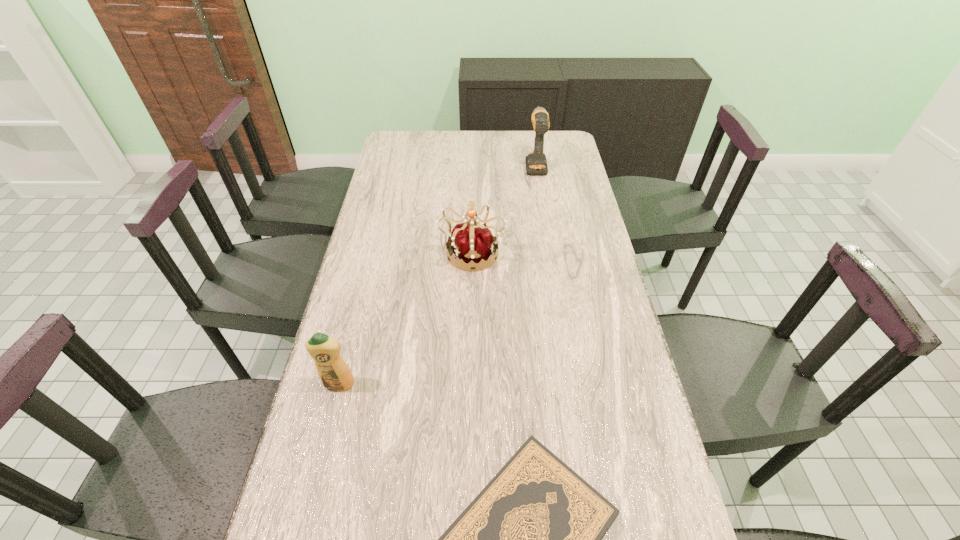
Point out which object is positioned as the second nearest to the drill. Please provide its 2D coordinates. Your answer should be formatted as a tuple, i.e. [(x, y)], where the tuple contains the x and y coordinates of a point satisfying the conditions above.

[(334, 373)]

Identify which object is located as the second nearest to the leftmost object. Please provide its 2D coordinates. Your answer should be formatted as a tuple, i.e. [(x, y)], where the tuple contains the x and y coordinates of a point satisfying the conditions above.

[(475, 245)]